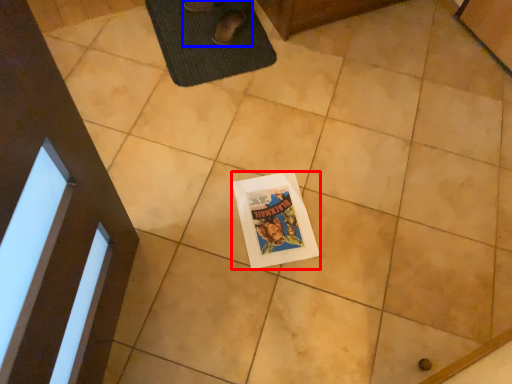
Question: Among these objects, which one is nearest to the camera, comic book (highlighted by a red box) or person (highlighted by a blue box)?

Choices:
 (A) comic book
 (B) person

Answer: (A)